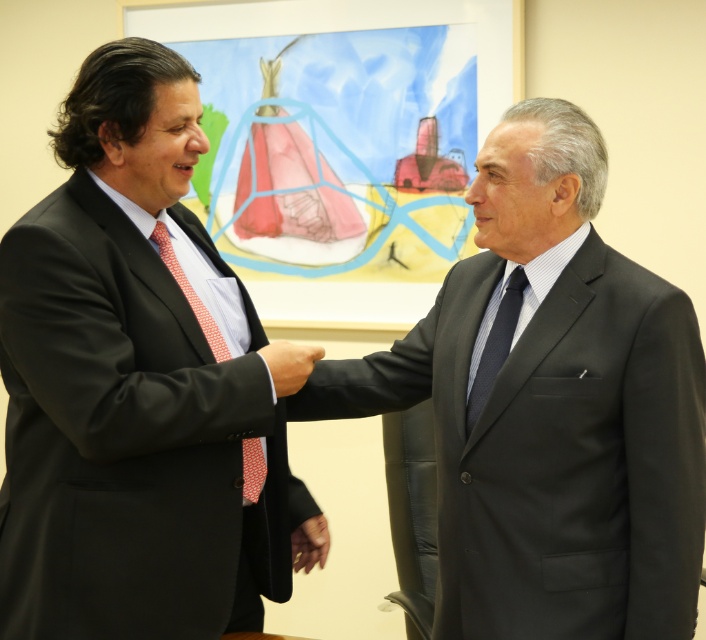
Question: Can you confirm if dark blue textured tie at center is smaller than black smooth suit at center?

Choices:
 (A) no
 (B) yes

Answer: (A)

Question: Based on their relative distances, which object is farther from the red dotted tie at center?

Choices:
 (A) dark blue textured tie at center
 (B) matte black suit at center

Answer: (A)

Question: Which point is closer to the camera?

Choices:
 (A) (301, 349)
 (B) (606, 529)

Answer: (B)

Question: Which object is positioned farthest from the black smooth suit at center?

Choices:
 (A) dark gray suit at center
 (B) dark blue textured tie at center
 (C) matte black suit at center
 (D) red dotted tie at center

Answer: (A)

Question: Is matte black suit at center wider than dark blue textured tie at center?

Choices:
 (A) yes
 (B) no

Answer: (A)

Question: Is matte black suit at center positioned before black smooth suit at center?

Choices:
 (A) no
 (B) yes

Answer: (B)